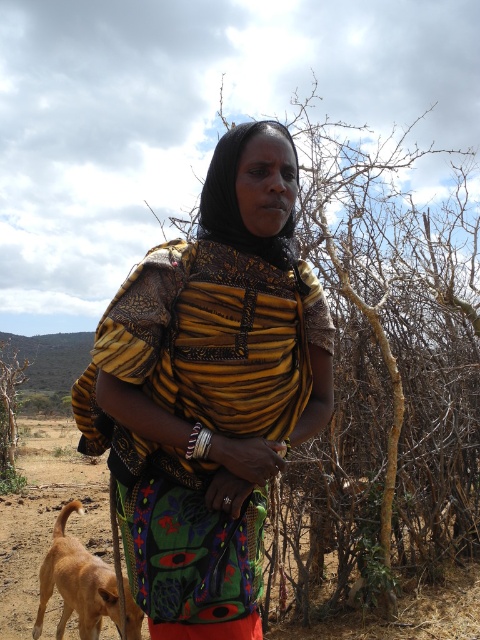
Question: Considering the real-world distances, which object is closest to the yellow textured fabric at center?

Choices:
 (A) light brown fur at lower left
 (B) brown sandy dirt at lower left

Answer: (A)

Question: Is yellow textured fabric at center positioned before light brown fur at lower left?

Choices:
 (A) no
 (B) yes

Answer: (B)

Question: Considering the real-world distances, which object is farthest from the light brown fur at lower left?

Choices:
 (A) brown sandy dirt at lower left
 (B) yellow textured fabric at center

Answer: (A)

Question: Can you confirm if yellow textured fabric at center is thinner than brown sandy dirt at lower left?

Choices:
 (A) no
 (B) yes

Answer: (B)

Question: From the image, what is the correct spatial relationship of yellow textured fabric at center in relation to light brown fur at lower left?

Choices:
 (A) right
 (B) left

Answer: (A)

Question: Which point appears closest to the camera in this image?

Choices:
 (A) (92, 618)
 (B) (203, 406)

Answer: (B)